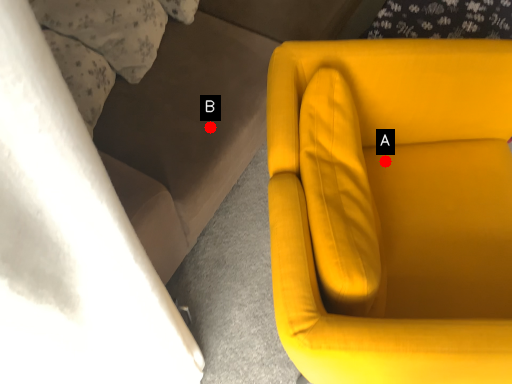
Question: Two points are circled on the image, labeled by A and B beside each circle. Which of the following is the farthest from the observer?

Choices:
 (A) A is further
 (B) B is further

Answer: (A)